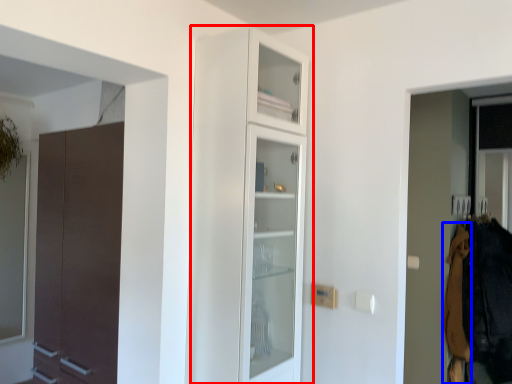
Question: Which object appears closest to the camera in this image, cupboard (highlighted by a red box) or clothing (highlighted by a blue box)?

Choices:
 (A) cupboard
 (B) clothing

Answer: (A)